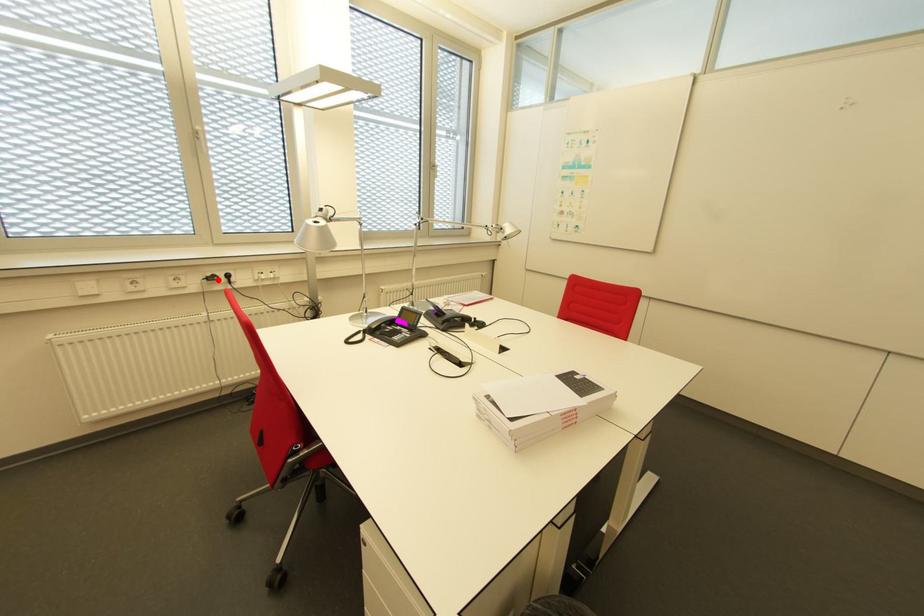
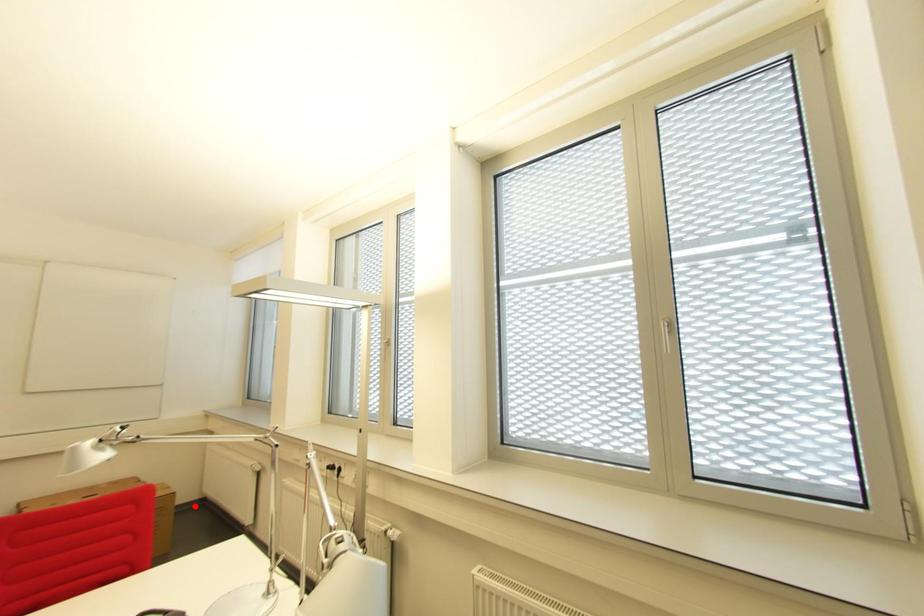
I am providing you with two images of the same scene from different viewpoints. A red point is marked on the first image and another point is marked on the second image. Are the points marked in image1 and image2 representing the same 3D position?

No